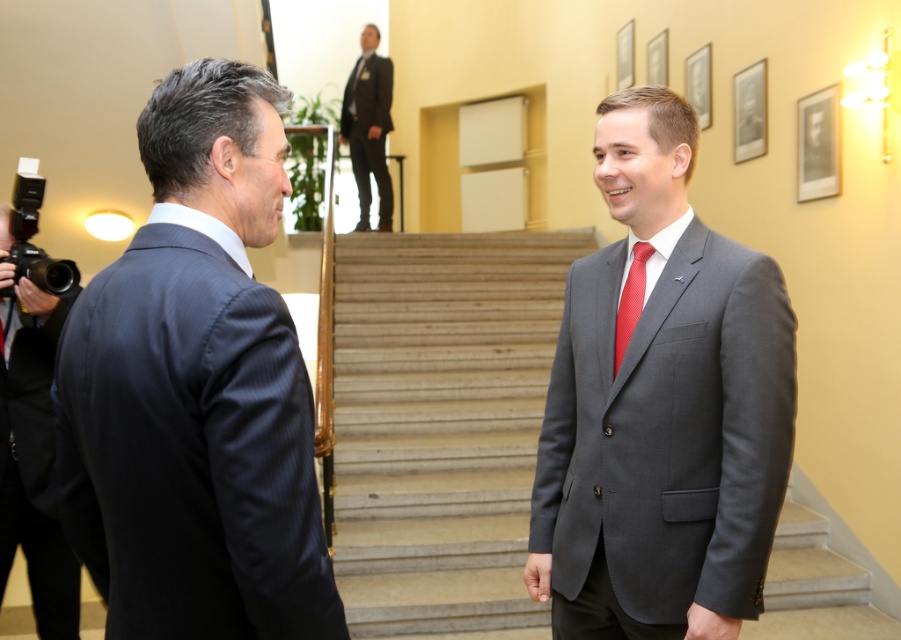
You are an event planner arranging a photoshoot in this setting. You need to position a light source to highlight both the dark blue suit at left and the red silk tie at center. Based on their positions, where should you place the light source to ensure both are illuminated adequately?

The dark blue suit at left is located below the red silk tie at center. To illuminate both adequately, position the light source above and between them so that it can cast light downward onto the dark blue suit at left and also reach the red silk tie at center placed higher up.

In the scene shown: You are a photographer setting up a shoot in this scene. You need to position a camera on a tripod so that both the dark blue suit at left and the matte gray suit at center are in frame. Considering their heights, which suit will appear larger in the photo?

The dark blue suit at left is shorter than the matte gray suit at center. Since the camera is positioned to capture both, the matte gray suit at center will appear larger in the photo due to its greater height.

You are standing at the bottom of the staircase and want to greet both individuals wearing the dark blue suit at left and the matte gray suit at center. Which one should you approach first if you want to reach the one closer to you first?

The dark blue suit at left is above the matte gray suit at center, so the matte gray suit at center is closer to you. Approach the matte gray suit at center first.